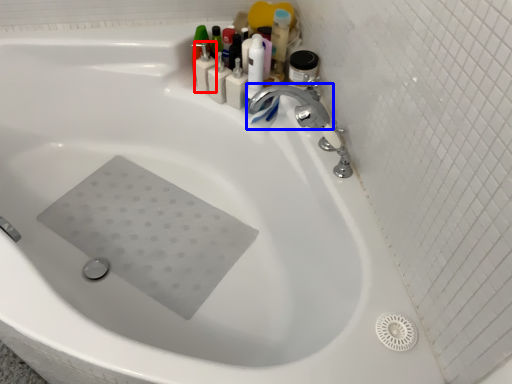
Question: Which of the following is the farthest to the observer, toiletry (highlighted by a red box) or tap (highlighted by a blue box)?

Choices:
 (A) toiletry
 (B) tap

Answer: (A)